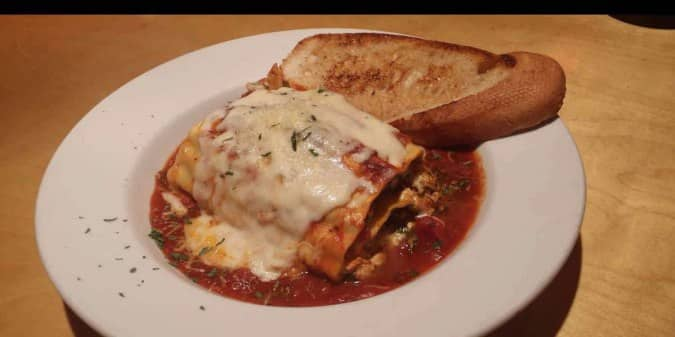
I want to click on plate shadow on left side, so click(x=84, y=329).